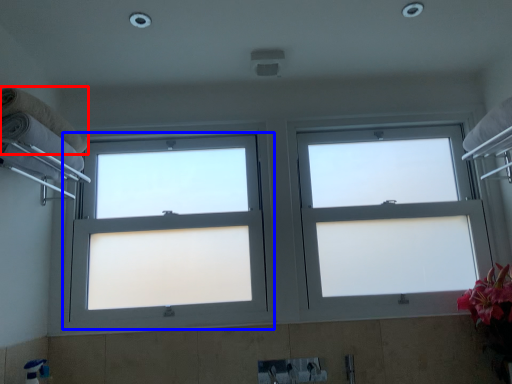
Question: Which object is closer to the camera taking this photo, towel (highlighted by a red box) or window (highlighted by a blue box)?

Choices:
 (A) towel
 (B) window

Answer: (A)